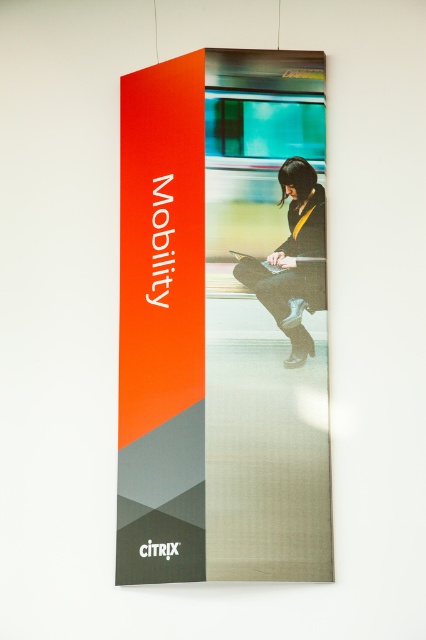
Who is more distant from viewer, (291,278) or (301,193)?

Point (291,278)

This screenshot has width=426, height=640. Find the location of `orange matte poster at center`. orange matte poster at center is located at coordinates (222, 321).

This screenshot has height=640, width=426. In order to click on orange matte poster at center in this screenshot , I will do `click(222, 321)`.